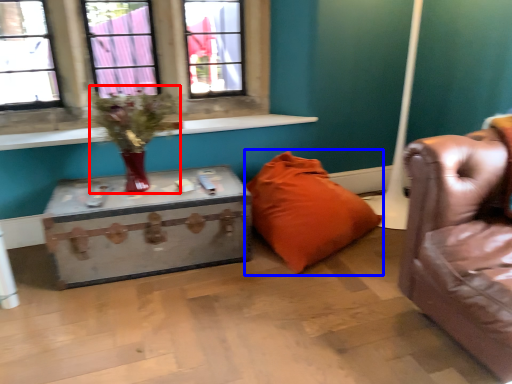
Question: Which object appears closest to the camera in this image, floral arrangement (highlighted by a red box) or pillow (highlighted by a blue box)?

Choices:
 (A) floral arrangement
 (B) pillow

Answer: (A)